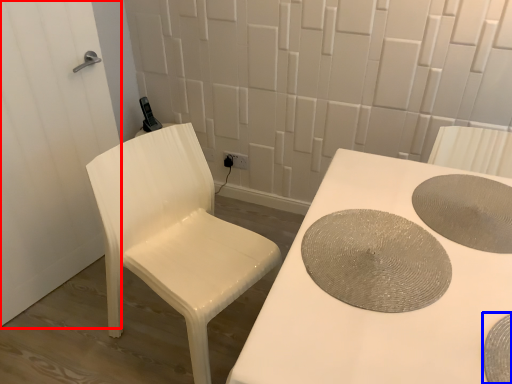
Question: Among these objects, which one is farthest to the camera, screen door (highlighted by a red box) or manhole cover (highlighted by a blue box)?

Choices:
 (A) screen door
 (B) manhole cover

Answer: (A)